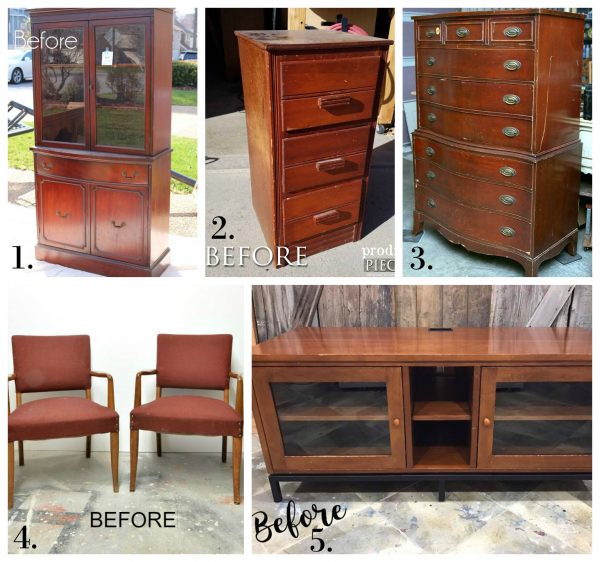
Locate an element on the screen. The width and height of the screenshot is (600, 562). brown wooden tv stand with glass doors is located at coordinates (352, 428).